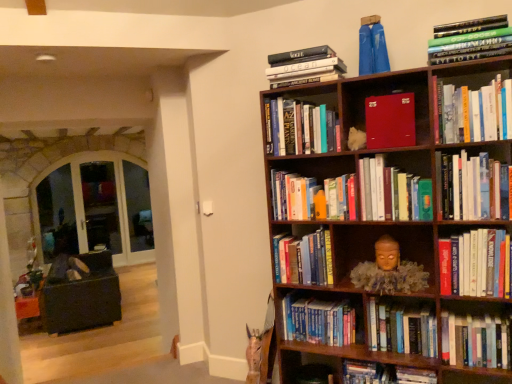
What do you see at coordinates (472, 187) in the screenshot? The width and height of the screenshot is (512, 384). I see `hardcover books at center right, the eighth book when ordered from bottom to top` at bounding box center [472, 187].

This screenshot has height=384, width=512. I want to click on hardcover books at center right, the eighth book when ordered from bottom to top, so click(472, 187).

Identify the location of hardcover book at center, which ranks as the 5th book in bottom-to-top order. The width and height of the screenshot is (512, 384). (304, 259).

What do you see at coordinates (476, 341) in the screenshot? The image size is (512, 384). I see `hardcover book at lower right, arranged as the twelfth book when viewed from the top` at bounding box center [476, 341].

Measure the distance between hardcover book at lower right, arranged as the twelfth book when viewed from the top, and camera.

hardcover book at lower right, arranged as the twelfth book when viewed from the top, is 6.37 feet away from camera.

I want to click on hardcover books at center right, the eighth book when ordered from bottom to top, so click(x=472, y=187).

Is hardcover book at center, which is counted as the ninth book, starting from the top, bigger than dark brown leather swivel chair at lower left?

Actually, hardcover book at center, which is counted as the ninth book, starting from the top, might be smaller than dark brown leather swivel chair at lower left.

Is point (333, 185) positioned behind point (61, 294)?

No, it is in front of (61, 294).

Which object is positioned more to the right, hardcover book at center, which is counted as the 6th book, starting from the bottom, or dark brown leather swivel chair at lower left?

From the viewer's perspective, hardcover book at center, which is counted as the 6th book, starting from the bottom, appears more on the right side.

Is dark brown leather swivel chair at lower left at the back of hardcover book at center, which is counted as the ninth book, starting from the top?

hardcover book at center, which is counted as the ninth book, starting from the top, is not turned away from dark brown leather swivel chair at lower left.

Is hardcover book at lower right, placed as the fourteenth book when sorted from top to bottom, facing away from hardcover books at center right, positioned as the seventh book in top-to-bottom order?

No, hardcover books at center right, positioned as the seventh book in top-to-bottom order, is not at the back of hardcover book at lower right, placed as the fourteenth book when sorted from top to bottom.

How many degrees apart are the facing directions of hardcover book at lower right, placed as the fourteenth book when sorted from top to bottom, and hardcover books at center right, the eighth book when ordered from bottom to top?

hardcover book at lower right, placed as the fourteenth book when sorted from top to bottom, and hardcover books at center right, the eighth book when ordered from bottom to top, are facing 1.57 degrees away from each other.

From a real-world perspective, who is located higher, hardcover book at lower right, which is counted as the first book, starting from the bottom, or hardcover books at center right, positioned as the seventh book in top-to-bottom order?

From a 3D spatial view, hardcover books at center right, positioned as the seventh book in top-to-bottom order, is above.

Does hardcover book at lower right, placed as the fourteenth book when sorted from top to bottom, have a lesser width compared to hardcover books at center right, the eighth book when ordered from bottom to top?

Indeed, hardcover book at lower right, placed as the fourteenth book when sorted from top to bottom, has a lesser width compared to hardcover books at center right, the eighth book when ordered from bottom to top.

Considering the relative sizes of matte black entertainment center at left and hardcover book at upper center, which is the 12th book in bottom-to-top order, in the image provided, is matte black entertainment center at left wider than hardcover book at upper center, which is the 12th book in bottom-to-top order,?

In fact, matte black entertainment center at left might be narrower than hardcover book at upper center, which is the 12th book in bottom-to-top order.

How many degrees apart are the facing directions of matte black entertainment center at left and hardcover book at upper center, which is the 12th book in bottom-to-top order?

The angle between the facing direction of matte black entertainment center at left and the facing direction of hardcover book at upper center, which is the 12th book in bottom-to-top order, is 42.3 degrees.

Which is nearer, (106, 161) or (313, 63)?

Point (106, 161) is farther from the camera than point (313, 63).

Could you tell me if hardcover book at lower right, placed as the 3th book when sorted from bottom to top, is facing matte red book at upper center, positioned as the 10th book in bottom-to-top order?

No, hardcover book at lower right, placed as the 3th book when sorted from bottom to top, is not turned towards matte red book at upper center, positioned as the 10th book in bottom-to-top order.

Does point (482, 365) appear closer or farther from the camera than point (399, 135)?

Point (482, 365).

In the scene shown: Which is more to the left, hardcover book at lower right, arranged as the twelfth book when viewed from the top, or matte red book at upper center, the fifth book when ordered from top to bottom?

matte red book at upper center, the fifth book when ordered from top to bottom.

Is hardcover book at lower right, placed as the 3th book when sorted from bottom to top, thinner than matte red book at upper center, the fifth book when ordered from top to bottom?

Indeed, hardcover book at lower right, placed as the 3th book when sorted from bottom to top, has a lesser width compared to matte red book at upper center, the fifth book when ordered from top to bottom.

From a real-world perspective, who is located lower, matte black entertainment center at left or hardcover books at upper right, which is the 13th book in bottom-to-top order?

matte black entertainment center at left, from a real-world perspective.

Based on the photo, does matte black entertainment center at left lie in front of hardcover books at upper right, placed as the second book when sorted from top to bottom?

No, the depth of matte black entertainment center at left is greater than that of hardcover books at upper right, placed as the second book when sorted from top to bottom.

From the image's perspective, who appears lower, matte black entertainment center at left or hardcover books at upper right, which is the 13th book in bottom-to-top order?

matte black entertainment center at left is shown below in the image.

Is matte red book at upper center, positioned as the 10th book in bottom-to-top order, positioned with its back to hardcover book at lower right, which is counted as the first book, starting from the bottom?

No, hardcover book at lower right, which is counted as the first book, starting from the bottom, is not at the back of matte red book at upper center, positioned as the 10th book in bottom-to-top order.

Is matte red book at upper center, the fifth book when ordered from top to bottom, with hardcover book at lower right, placed as the fourteenth book when sorted from top to bottom?

No, matte red book at upper center, the fifth book when ordered from top to bottom, is not with hardcover book at lower right, placed as the fourteenth book when sorted from top to bottom.

Would you say matte red book at upper center, the fifth book when ordered from top to bottom, is to the left or to the right of hardcover book at lower right, which is counted as the first book, starting from the bottom, in the picture?

matte red book at upper center, the fifth book when ordered from top to bottom, is positioned on hardcover book at lower right, which is counted as the first book, starting from the bottom,'s left side.

From the image's perspective, is matte red book at upper center, the fifth book when ordered from top to bottom, below hardcover book at lower right, which is counted as the first book, starting from the bottom?

No, from the image's perspective, matte red book at upper center, the fifth book when ordered from top to bottom, is not beneath hardcover book at lower right, which is counted as the first book, starting from the bottom.

Is hardcover book at lower right, arranged as the twelfth book when viewed from the top, to the left or to the right of hardcover book at lower right, placed as the fourteenth book when sorted from top to bottom, in the image?

hardcover book at lower right, arranged as the twelfth book when viewed from the top, is positioned on hardcover book at lower right, placed as the fourteenth book when sorted from top to bottom,'s right side.

From the image's perspective, count 2nd books upward from the hardcover book at lower right, which is counted as the first book, starting from the bottom, and point to it. Please provide its 2D coordinates.

[(476, 341)]

Who is bigger, hardcover book at lower right, arranged as the twelfth book when viewed from the top, or hardcover book at lower right, which is counted as the first book, starting from the bottom?

With larger size is hardcover book at lower right, which is counted as the first book, starting from the bottom.

Is hardcover book at lower right, arranged as the twelfth book when viewed from the top, shorter than hardcover book at lower right, which is counted as the first book, starting from the bottom?

Yes, hardcover book at lower right, arranged as the twelfth book when viewed from the top, is shorter than hardcover book at lower right, which is counted as the first book, starting from the bottom.

From the dark brown leather swivel chair at lower left, count 3rd books forward and point to it. Please provide its 2D coordinates.

[(313, 197)]

Starting from the hardcover books at center right, positioned as the seventh book in top-to-bottom order, which book is the 4th one to the left? Please provide its 2D coordinates.

[(384, 374)]

Based on their spatial positions, is hardcover book at upper center, which is the 12th book in bottom-to-top order, or hardcover book at center, which ranks as the 5th book in bottom-to-top order, closer to hardcover book at lower right, arranged as the twelfth book when viewed from the top?

The object closer to hardcover book at lower right, arranged as the twelfth book when viewed from the top, is hardcover book at center, which ranks as the 5th book in bottom-to-top order.

Based on their spatial positions, is hardcover book at upper right, the 4th book in the top-to-bottom sequence, or blue hardcover book at center, marked as the 2th book in a bottom-to-top arrangement, further from hardcover books at lower right?

hardcover book at upper right, the 4th book in the top-to-bottom sequence, is positioned further to the anchor hardcover books at lower right.

Looking at this image, considering their positions, is hardcover books at lower right positioned further to hardcover books at center, which is the eleventh book from top to bottom, than dark brown leather swivel chair at lower left?

The object further to hardcover books at center, which is the eleventh book from top to bottom, is dark brown leather swivel chair at lower left.

From the image, which object appears to be nearer to hardcover book at lower right, placed as the fourteenth book when sorted from top to bottom, hardcover books at lower right or hardcover book at upper right, the 4th book in the top-to-bottom sequence?

Based on the image, hardcover books at lower right appears to be nearer to hardcover book at lower right, placed as the fourteenth book when sorted from top to bottom.

When comparing their distances from blue hardcover book at center, arranged as the thirteenth book when viewed from the top, does blue fabric pants at upper center, which ranks as the first book in top-to-bottom order, or hardcover books at center right, positioned as the seventh book in top-to-bottom order, seem closer?

hardcover books at center right, positioned as the seventh book in top-to-bottom order, is closer to blue hardcover book at center, arranged as the thirteenth book when viewed from the top.

When comparing their distances from hardcover book at upper center, the 3th book in the top-to-bottom sequence, does hardcover books at center right, the eighth book when ordered from bottom to top, or hardcover books at upper right, placed as the second book when sorted from top to bottom, seem further?

hardcover books at center right, the eighth book when ordered from bottom to top, is further to hardcover book at upper center, the 3th book in the top-to-bottom sequence.

From the image, which object appears to be nearer to blue hardcover book at center, marked as the 2th book in a bottom-to-top arrangement, matte black entertainment center at left or hardcover book at upper center, the 3th book in the top-to-bottom sequence?

hardcover book at upper center, the 3th book in the top-to-bottom sequence.

Considering their positions, is blue hardcover book at center, marked as the 2th book in a bottom-to-top arrangement, positioned further to hardcover book at upper right, the 4th book in the top-to-bottom sequence, than hardcover books at center, placed as the 4th book when sorted from bottom to top?

Among the two, blue hardcover book at center, marked as the 2th book in a bottom-to-top arrangement, is located further to hardcover book at upper right, the 4th book in the top-to-bottom sequence.

I want to click on person between hardcover books at upper right, which is the 13th book in bottom-to-top order, and blue hardcover book at center, arranged as the thirteenth book when viewed from the top, from top to bottom, so click(389, 271).

What are the coordinates of `shelf located between dark brown leather swivel chair at lower left and hardcover book at lower right, which is counted as the first book, starting from the bottom, in the left-right direction` in the screenshot? It's located at (308, 368).

This screenshot has height=384, width=512. What are the coordinates of `person located between hardcover book at center, which ranks as the 5th book in bottom-to-top order, and hardcover books at center right, positioned as the seventh book in top-to-bottom order, in the left-right direction` in the screenshot? It's located at (389, 271).

You are a GUI agent. You are given a task and a screenshot of the screen. Output one action in this format:
    pyautogui.click(x=<x>, y=<y>)
    Task: Click on the person positioned between hardcover book at upper right, the 4th book in the top-to-bottom sequence, and matte black entertainment center at left from near to far
    The image size is (512, 384).
    Given the screenshot: What is the action you would take?
    pyautogui.click(x=389, y=271)